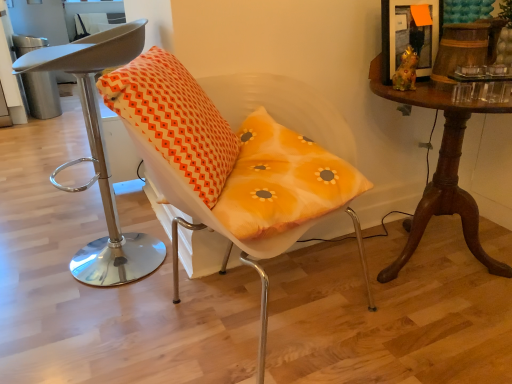
Question: Considering the positions of point [234, 157] and point [463, 120], is point [234, 157] closer or farther from the camera than point [463, 120]?

Choices:
 (A) closer
 (B) farther

Answer: (A)

Question: Is orange printed cushion at center in front of or behind mahogany wood table at right in the image?

Choices:
 (A) behind
 (B) front

Answer: (B)

Question: Which object is positioned farthest from the mahogany wood table at right?

Choices:
 (A) orange printed cushion at center
 (B) wooden picture frame at upper right
 (C) matte gray stool at left, the second chair viewed from the right
 (D) matte orange cushion at center, arranged as the 2th chair when viewed from the left

Answer: (C)

Question: Which object is positioned closest to the matte orange cushion at center, the first chair positioned from the right?

Choices:
 (A) wooden picture frame at upper right
 (B) matte gray stool at left, which is counted as the first chair, starting from the left
 (C) orange printed cushion at center
 (D) mahogany wood table at right

Answer: (C)